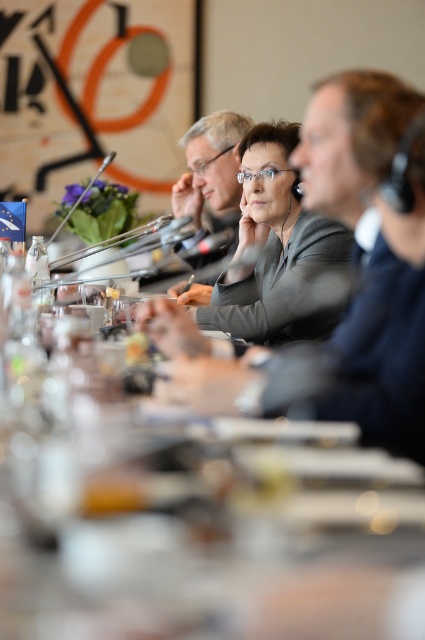
Question: Does clear plastic cups at center appear on the left side of matte black glasses at center?

Choices:
 (A) no
 (B) yes

Answer: (A)

Question: Which object is closer to the camera taking this photo?

Choices:
 (A) matte gray suit at center
 (B) clear plastic cups at center
 (C) matte black glasses at center

Answer: (B)

Question: From the image, what is the correct spatial relationship of clear plastic cups at center in relation to matte black glasses at center?

Choices:
 (A) right
 (B) left

Answer: (A)

Question: Which point is closer to the camera?

Choices:
 (A) matte black glasses at center
 (B) matte gray suit at center
 (C) clear plastic cups at center

Answer: (C)

Question: Does matte gray suit at center have a smaller size compared to matte black glasses at center?

Choices:
 (A) yes
 (B) no

Answer: (B)

Question: Which point is closer to the camera?

Choices:
 (A) matte black glasses at center
 (B) clear plastic cups at center

Answer: (B)